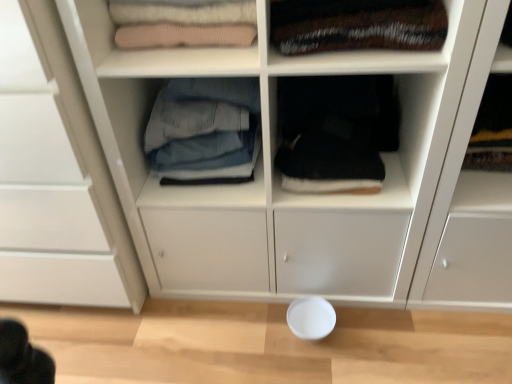
Question: Is knit fabric sweater at upper left, the second shelf from the bottom, in front of denim jeans at center, the second clothing positioned from the right?

Choices:
 (A) yes
 (B) no

Answer: (A)

Question: From a real-world perspective, does knit fabric sweater at upper left, which appears as the 1th shelf when viewed from the left, sit lower than denim jeans at center, the second clothing positioned from the right?

Choices:
 (A) no
 (B) yes

Answer: (A)

Question: Considering the relative sizes of knit fabric sweater at upper left, acting as the 2th shelf starting from the right, and denim jeans at center, acting as the 1th clothing starting from the left, in the image provided, is knit fabric sweater at upper left, acting as the 2th shelf starting from the right, shorter than denim jeans at center, acting as the 1th clothing starting from the left,?

Choices:
 (A) yes
 (B) no

Answer: (A)

Question: Does knit fabric sweater at upper left, which appears as the 1th shelf when viewed from the left, have a larger size compared to denim jeans at center, acting as the 1th clothing starting from the left?

Choices:
 (A) no
 (B) yes

Answer: (A)

Question: Considering the relative sizes of knit fabric sweater at upper left, the second shelf from the bottom, and denim jeans at center, acting as the 1th clothing starting from the left, in the image provided, is knit fabric sweater at upper left, the second shelf from the bottom, taller than denim jeans at center, acting as the 1th clothing starting from the left,?

Choices:
 (A) yes
 (B) no

Answer: (B)

Question: Can you confirm if knit fabric sweater at upper left, the second shelf from the bottom, is positioned to the left of denim jeans at center, acting as the 1th clothing starting from the left?

Choices:
 (A) no
 (B) yes

Answer: (B)

Question: From the image's perspective, is knit fabric sweater at upper left, placed as the 1th shelf when sorted from top to bottom, located beneath black fabric at center, which is the 1th shelf from right to left?

Choices:
 (A) no
 (B) yes

Answer: (A)

Question: Are knit fabric sweater at upper left, the second shelf from the bottom, and black fabric at center, which is counted as the second shelf, starting from the left, far apart?

Choices:
 (A) no
 (B) yes

Answer: (A)

Question: Is knit fabric sweater at upper left, placed as the 1th shelf when sorted from top to bottom, wider than black fabric at center, which is the 1th shelf from right to left?

Choices:
 (A) yes
 (B) no

Answer: (B)

Question: Is knit fabric sweater at upper left, which appears as the 1th shelf when viewed from the left, bigger than black fabric at center, the 1th shelf from the bottom?

Choices:
 (A) yes
 (B) no

Answer: (B)

Question: Is knit fabric sweater at upper left, acting as the 2th shelf starting from the right, to the left of black fabric at center, which is counted as the second shelf, starting from the left, from the viewer's perspective?

Choices:
 (A) no
 (B) yes

Answer: (B)

Question: Is knit fabric sweater at upper left, the second shelf from the bottom, not inside black fabric at center, which is the 1th shelf from right to left?

Choices:
 (A) yes
 (B) no

Answer: (A)

Question: Can you confirm if knit fabric sweater at upper left, acting as the 2th shelf starting from the right, is thinner than velvet-like brown blanket at upper right, the 2th clothing viewed from the left?

Choices:
 (A) yes
 (B) no

Answer: (A)